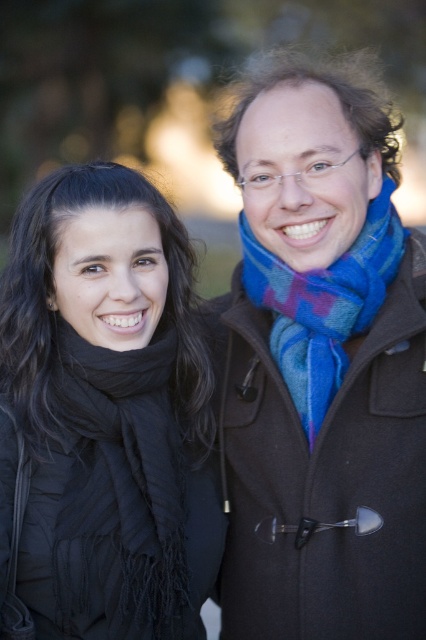
You are a photographer trying to capture both the black soft scarf at left and the blue woven scarf at center in a single frame. Since the background is blurred, which scarf should you focus on to ensure both are in focus?

The black soft scarf at left is bigger than the blue woven scarf at center, so focusing on the larger black soft scarf at left would ensure both are in focus as it occupies more space in the frame.

You are standing 5 feet away from the image. Is the point at coordinates point [212,557] closer than you are to the image?

The distance of point [212,557] from viewer is 6.79 feet, so if you are standing 5 feet away from the image, the point is farther away than you are.